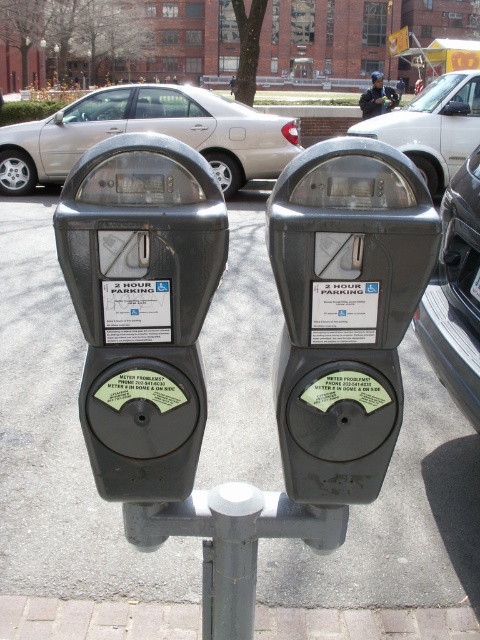
Does point (429, 344) come behind point (465, 96)?

That is False.

Can you confirm if metallic gray car at right is positioned below silver metallic van at center?

Yes.

Does point (452, 225) come closer to viewer compared to point (446, 172)?

Yes, point (452, 225) is in front of point (446, 172).

At what (x,y) coordinates should I click in order to perform the action: click on metallic gray car at right. Please return your answer as a coordinate pair (x, y). The height and width of the screenshot is (640, 480). Looking at the image, I should click on (456, 294).

How distant is silver metallic sedan at left from metallic gray car at right?

6.57 meters

Who is more distant from viewer, (x=96, y=120) or (x=432, y=308)?

The point (x=96, y=120) is behind.

What do you see at coordinates (148, 131) in the screenshot? I see `silver metallic sedan at left` at bounding box center [148, 131].

Where is `silver metallic sedan at left`? Image resolution: width=480 pixels, height=640 pixels. silver metallic sedan at left is located at coordinates (148, 131).

Between brick at lower left and silver metallic van at center, which one is positioned higher?

Positioned higher is silver metallic van at center.

Is brick at lower left positioned in front of silver metallic van at center?

Yes.

Describe the element at coordinates (96, 620) in the screenshot. I see `brick at lower left` at that location.

The image size is (480, 640). I want to click on brick at lower left, so click(x=96, y=620).